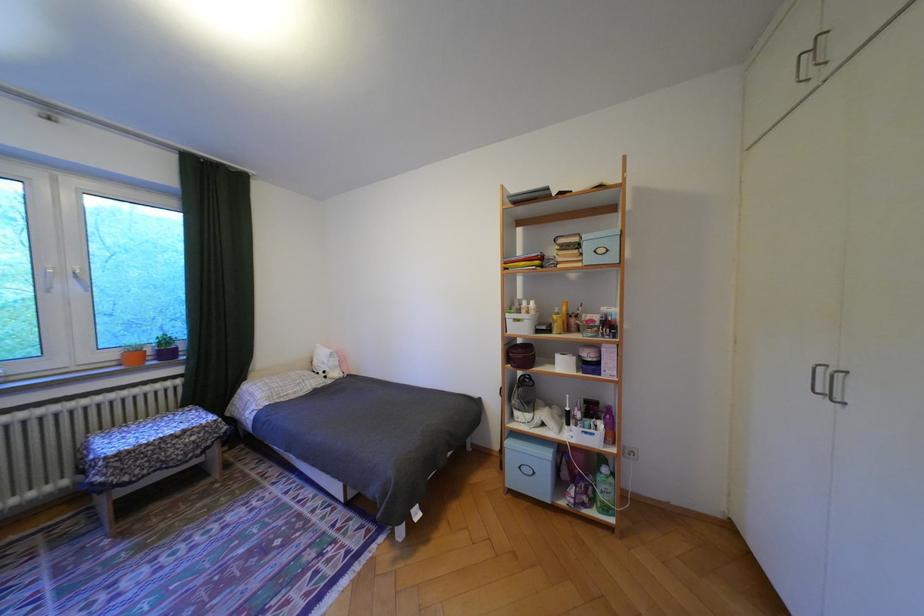
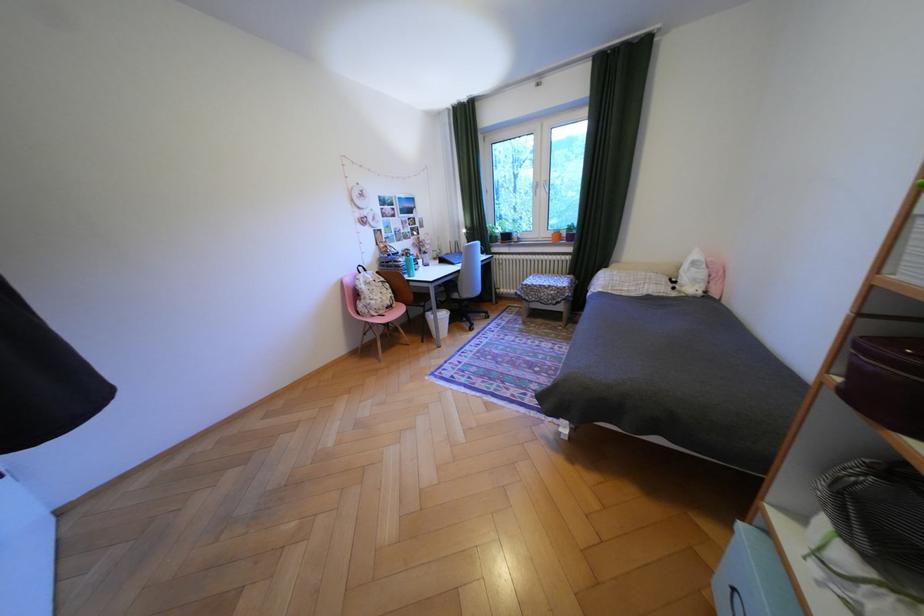
In the second image, find the point that corresponds to pixel 335 371 in the first image.

(687, 282)